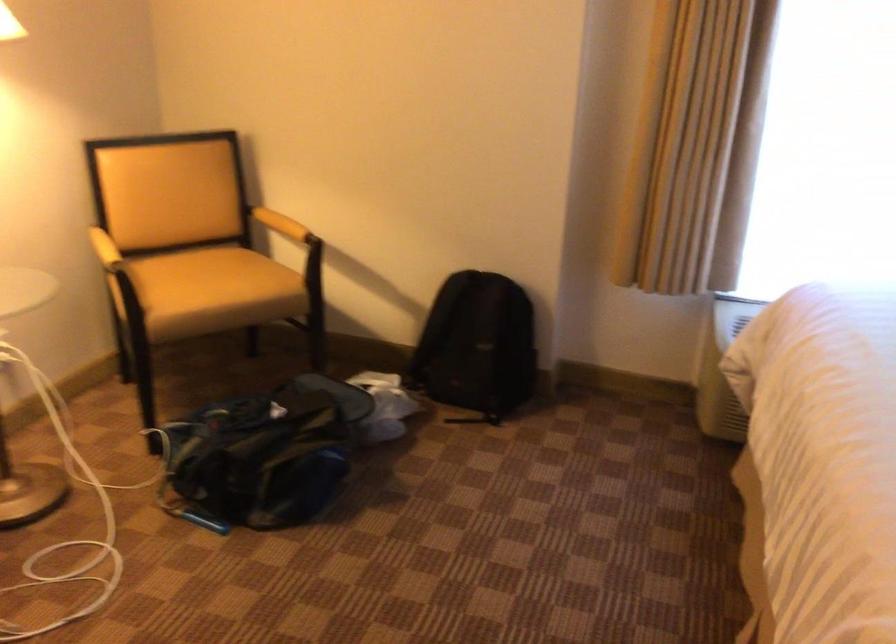
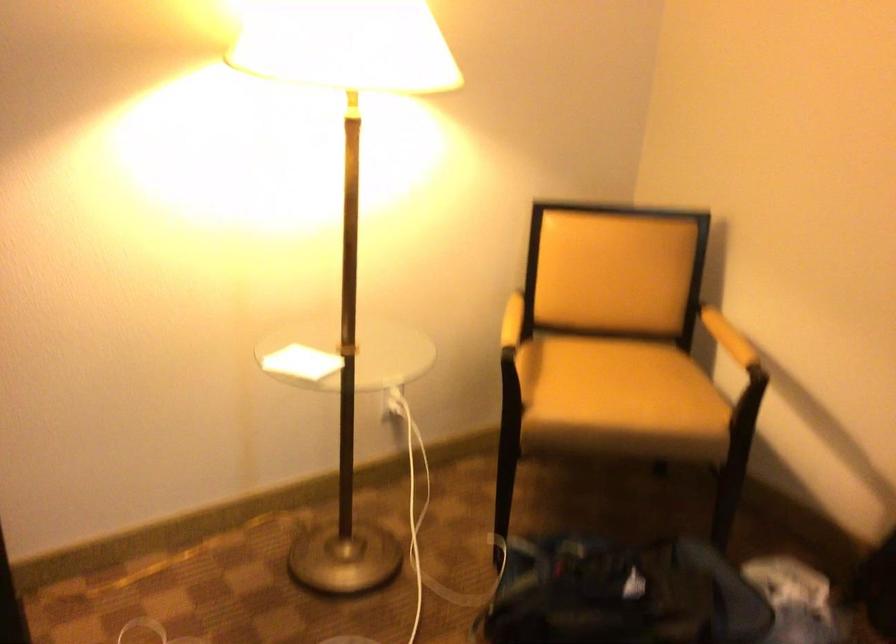
Where in the second image is the point corresponding to [288,222] from the first image?

(728, 337)